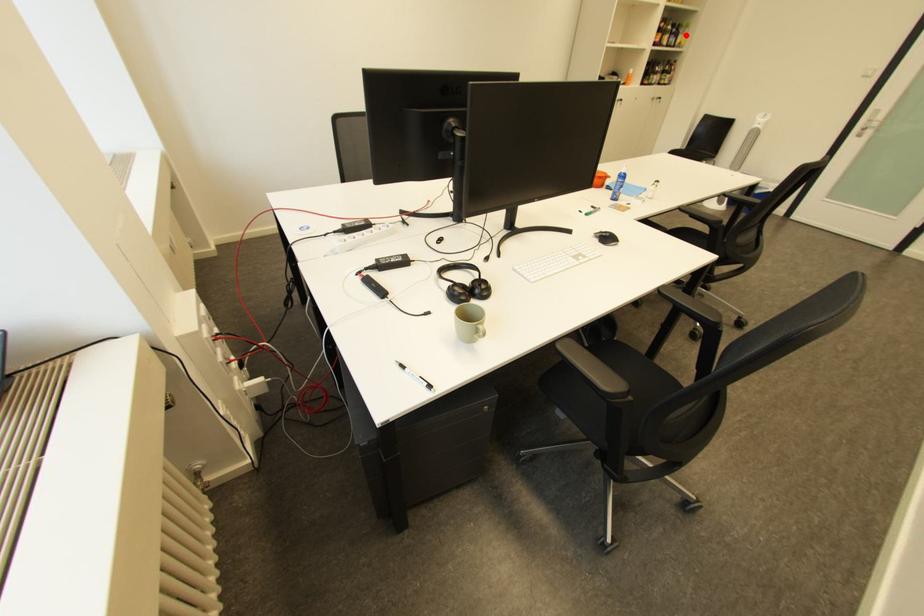
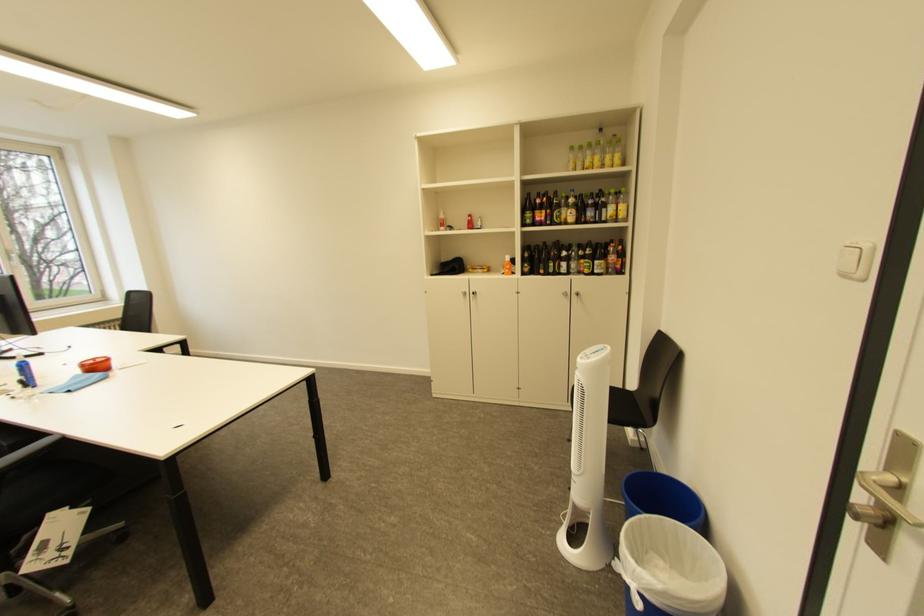
Question: A red point is marked in image1. In image2, is the corresponding 3D point closer to the camera or farther? Reply with the corresponding letter.

Choices:
 (A) The corresponding 3D point is closer.
 (B) The corresponding 3D point is farther.

Answer: (A)